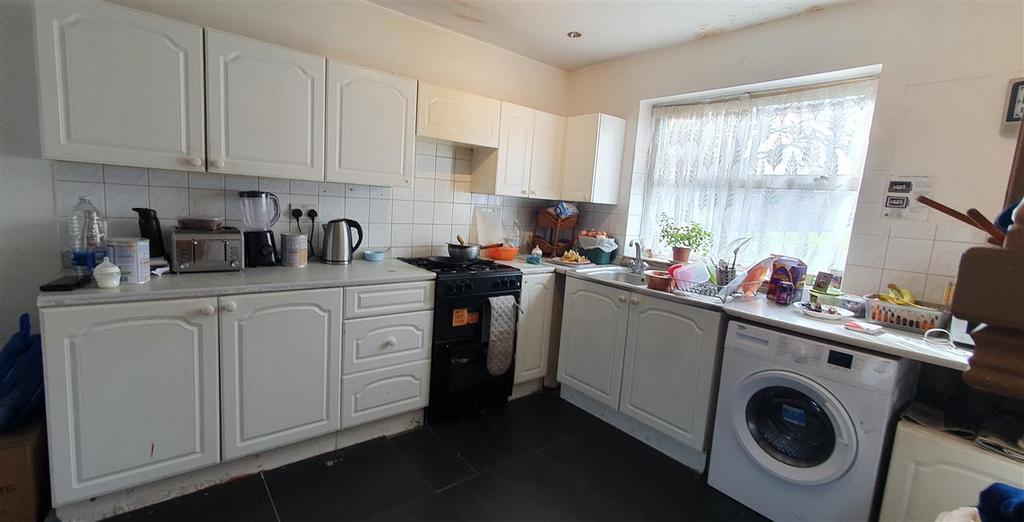
The width and height of the screenshot is (1024, 522). Find the location of `microwave`. microwave is located at coordinates (213, 253).